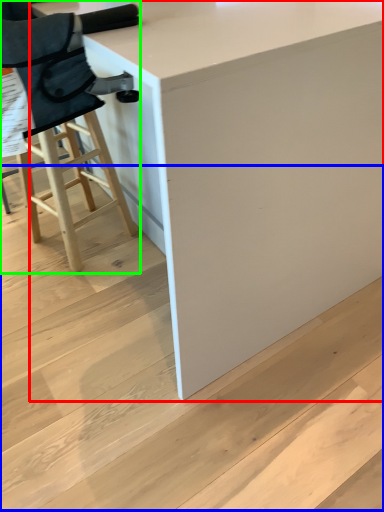
Question: Considering the real-world distances, which object is closest to table (highlighted by a red box)? stair (highlighted by a blue box) or chair (highlighted by a green box).

Choices:
 (A) stair
 (B) chair

Answer: (A)